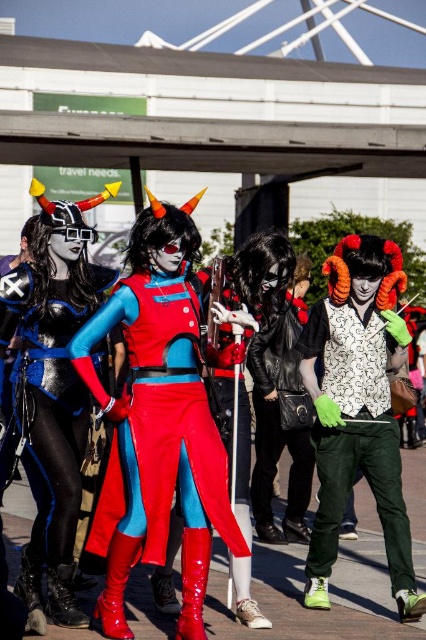
You are a photographer at the convention, and you want to capture a photo of both the shiny red boots at center and the metallic blue bodysuit at center. Based on their positions, which object should you focus on first to ensure both are in frame?

The metallic blue bodysuit at center is on the left side of the shiny red boots at center, so focusing on the metallic blue bodysuit at center first would ensure both are in frame as you adjust the camera.